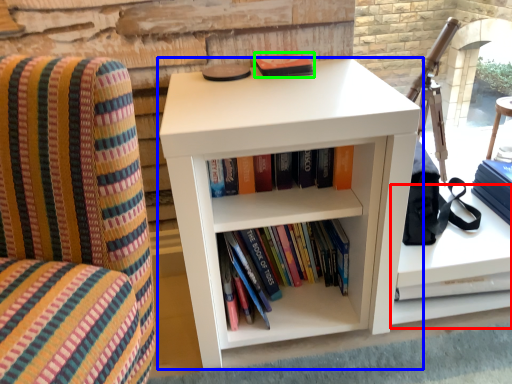
Question: Based on their relative distances, which object is nearer to cabinet (highlighted by a red box)? Choose from shelf (highlighted by a blue box) and paperback book (highlighted by a green box).

Choices:
 (A) shelf
 (B) paperback book

Answer: (A)